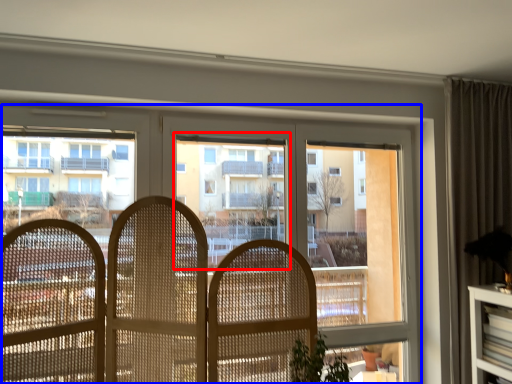
Question: Among these objects, which one is nearest to the camera, bay window (highlighted by a red box) or window (highlighted by a blue box)?

Choices:
 (A) bay window
 (B) window

Answer: (B)